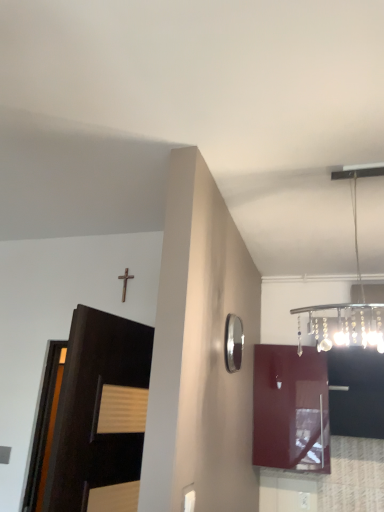
Question: From the image's perspective, would you say dark wood door at left is shown under black glossy cabinet at upper right, marked as the second cabinetry in a left-to-right arrangement?

Choices:
 (A) yes
 (B) no

Answer: (B)

Question: Does dark wood door at left lie behind black glossy cabinet at upper right, marked as the second cabinetry in a left-to-right arrangement?

Choices:
 (A) no
 (B) yes

Answer: (A)

Question: Does dark wood door at left have a larger size compared to black glossy cabinet at upper right, marked as the first cabinetry in a right-to-left arrangement?

Choices:
 (A) no
 (B) yes

Answer: (B)

Question: From a real-world perspective, is dark wood door at left on top of black glossy cabinet at upper right, marked as the first cabinetry in a right-to-left arrangement?

Choices:
 (A) yes
 (B) no

Answer: (B)

Question: Would you say dark wood door at left contains black glossy cabinet at upper right, marked as the first cabinetry in a right-to-left arrangement?

Choices:
 (A) no
 (B) yes

Answer: (A)

Question: Relative to metallic chandelier at upper right, is silver/metallic mirror at upper right in front or behind?

Choices:
 (A) front
 (B) behind

Answer: (B)

Question: From their relative heights in the image, would you say silver/metallic mirror at upper right is taller or shorter than metallic chandelier at upper right?

Choices:
 (A) short
 (B) tall

Answer: (A)

Question: Is point (238, 367) closer or farther from the camera than point (327, 329)?

Choices:
 (A) farther
 (B) closer

Answer: (B)

Question: From the image's perspective, relative to metallic chandelier at upper right, is silver/metallic mirror at upper right above or below?

Choices:
 (A) above
 (B) below

Answer: (B)

Question: In terms of width, does black glossy cabinet at upper right, marked as the second cabinetry in a left-to-right arrangement, look wider or thinner when compared to metallic chandelier at upper right?

Choices:
 (A) thin
 (B) wide

Answer: (B)

Question: Visually, is black glossy cabinet at upper right, marked as the second cabinetry in a left-to-right arrangement, positioned to the left or to the right of metallic chandelier at upper right?

Choices:
 (A) left
 (B) right

Answer: (B)

Question: From a real-world perspective, is black glossy cabinet at upper right, marked as the first cabinetry in a right-to-left arrangement, above or below metallic chandelier at upper right?

Choices:
 (A) below
 (B) above

Answer: (A)

Question: In terms of height, does black glossy cabinet at upper right, marked as the second cabinetry in a left-to-right arrangement, look taller or shorter compared to metallic chandelier at upper right?

Choices:
 (A) tall
 (B) short

Answer: (B)

Question: From the image's perspective, is metallic chandelier at upper right positioned above or below black glossy cabinet at upper right, marked as the first cabinetry in a right-to-left arrangement?

Choices:
 (A) below
 (B) above

Answer: (B)

Question: Considering the positions of metallic chandelier at upper right and black glossy cabinet at upper right, marked as the second cabinetry in a left-to-right arrangement, in the image, is metallic chandelier at upper right wider or thinner than black glossy cabinet at upper right, marked as the second cabinetry in a left-to-right arrangement,?

Choices:
 (A) thin
 (B) wide

Answer: (A)